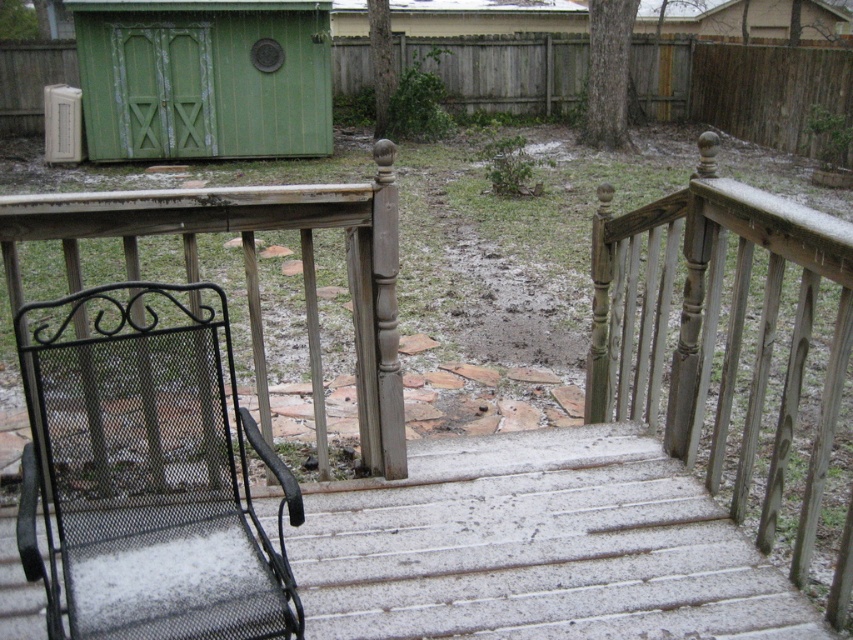
Does point (647, 253) come behind point (122, 140)?

That is False.

Looking at this image, is sanded wood rail at upper right wider than green wooden shed at upper left?

No.

Which is in front, point (837, 381) or point (142, 44)?

Point (837, 381)

Locate an element on the screen. Image resolution: width=853 pixels, height=640 pixels. sanded wood rail at upper right is located at coordinates (717, 330).

Between black mesh chair at lower left and sanded wood rail at upper right, which one appears on the left side from the viewer's perspective?

black mesh chair at lower left is more to the left.

Does black mesh chair at lower left appear on the right side of sanded wood rail at upper right?

No, black mesh chair at lower left is not to the right of sanded wood rail at upper right.

Does point (155, 320) come behind point (764, 323)?

Yes, point (155, 320) is behind point (764, 323).

In order to click on black mesh chair at lower left in this screenshot , I will do `click(148, 470)`.

Who is more distant from viewer, (84, 506) or (300, 3)?

Positioned behind is point (300, 3).

Which is above, black mesh chair at lower left or green wooden shed at upper left?

green wooden shed at upper left is above.

Is point (213, 465) closer to viewer compared to point (132, 148)?

Yes, it is.

Locate an element on the screen. black mesh chair at lower left is located at coordinates (148, 470).